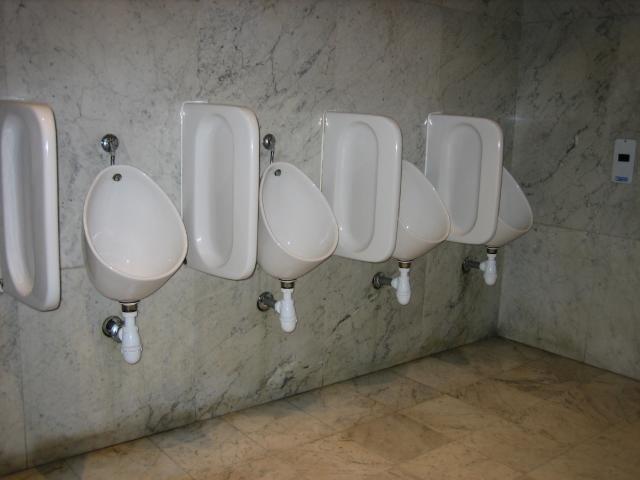
Identify the location of mens potty. The image size is (640, 480). (146, 195), (269, 204), (403, 194), (505, 201).